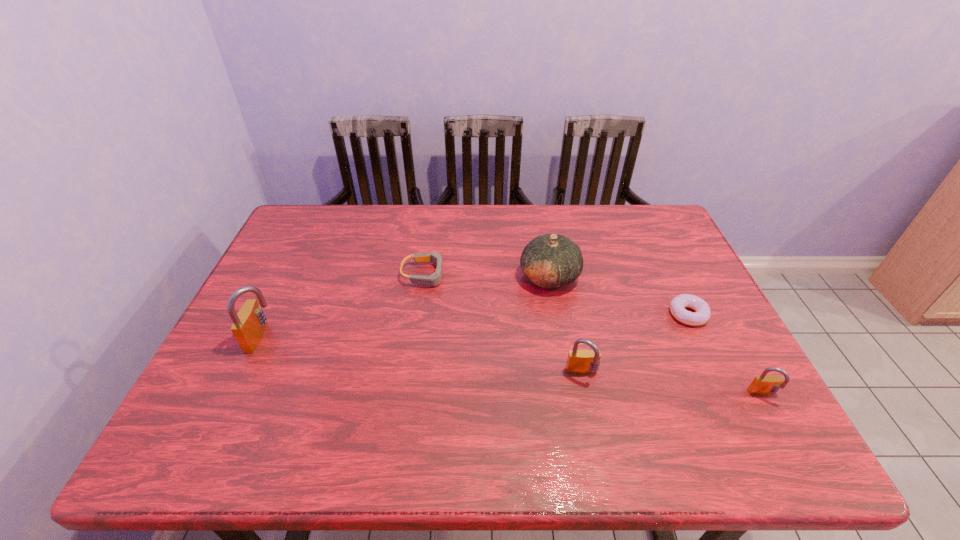
If the aim is uniform spacing by inserting an additional padlock among them, please point to a vacant space for this new padlock. Please provide its 2D coordinates. Your answer should be formatted as a tuple, i.e. [(x, y)], where the tuple contains the x and y coordinates of a point satisfying the conditions above.

[(416, 355)]